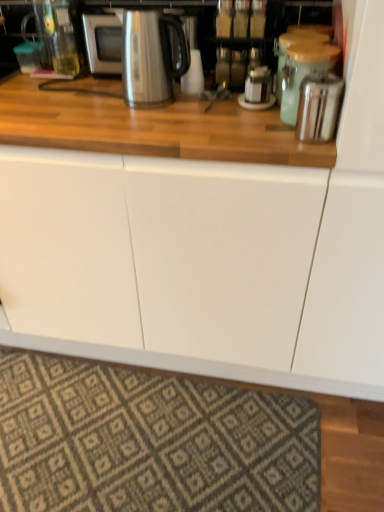
Question: Is satin silver toaster at upper right, which appears as the third appliance when viewed from the back, not within metallic silver canister at upper right, arranged as the first appliance when viewed from the back?

Choices:
 (A) no
 (B) yes

Answer: (B)

Question: Is satin silver toaster at upper right, the first appliance from the front, taller than metallic silver canister at upper right, the third appliance in the front-to-back sequence?

Choices:
 (A) no
 (B) yes

Answer: (A)

Question: Could you tell me if satin silver toaster at upper right, the first appliance from the front, is turned towards metallic silver canister at upper right, arranged as the first appliance when viewed from the back?

Choices:
 (A) no
 (B) yes

Answer: (A)

Question: From a real-world perspective, is satin silver toaster at upper right, the first appliance from the front, positioned under metallic silver canister at upper right, arranged as the first appliance when viewed from the back, based on gravity?

Choices:
 (A) no
 (B) yes

Answer: (B)

Question: Considering the relative positions of satin silver toaster at upper right, the first appliance from the front, and metallic silver canister at upper right, the third appliance in the front-to-back sequence, in the image provided, is satin silver toaster at upper right, the first appliance from the front, to the left of metallic silver canister at upper right, the third appliance in the front-to-back sequence, from the viewer's perspective?

Choices:
 (A) yes
 (B) no

Answer: (B)

Question: Would you say stainless steel kettle at upper center is inside or outside satin silver microwave at upper center?

Choices:
 (A) inside
 (B) outside

Answer: (B)

Question: Considering the positions of point (150, 105) and point (84, 31), is point (150, 105) closer or farther from the camera than point (84, 31)?

Choices:
 (A) closer
 (B) farther

Answer: (A)

Question: From the image's perspective, is stainless steel kettle at upper center above or below satin silver microwave at upper center?

Choices:
 (A) above
 (B) below

Answer: (B)

Question: From a real-world perspective, is stainless steel kettle at upper center physically located above or below satin silver microwave at upper center?

Choices:
 (A) above
 (B) below

Answer: (A)

Question: Is satin silver toaster at upper right, which appears as the third appliance when viewed from the back, spatially inside green matte jar at upper right, which appears as the 2th appliance when viewed from the front, or outside of it?

Choices:
 (A) inside
 (B) outside

Answer: (B)

Question: Is point (316, 74) closer or farther from the camera than point (336, 64)?

Choices:
 (A) farther
 (B) closer

Answer: (B)

Question: Is satin silver toaster at upper right, the first appliance from the front, bigger or smaller than green matte jar at upper right, which appears as the 2th appliance when viewed from the front?

Choices:
 (A) small
 (B) big

Answer: (A)

Question: Looking at their shapes, would you say satin silver toaster at upper right, the first appliance from the front, is wider or thinner than green matte jar at upper right, which appears as the 2th appliance when viewed from the front?

Choices:
 (A) thin
 (B) wide

Answer: (A)

Question: Which is correct: green matte jar at upper right, acting as the second appliance starting from the back, is inside patterned carpet at lower center, or outside of it?

Choices:
 (A) inside
 (B) outside

Answer: (B)

Question: Considering the positions of green matte jar at upper right, which appears as the 2th appliance when viewed from the front, and patterned carpet at lower center in the image, is green matte jar at upper right, which appears as the 2th appliance when viewed from the front, wider or thinner than patterned carpet at lower center?

Choices:
 (A) wide
 (B) thin

Answer: (B)